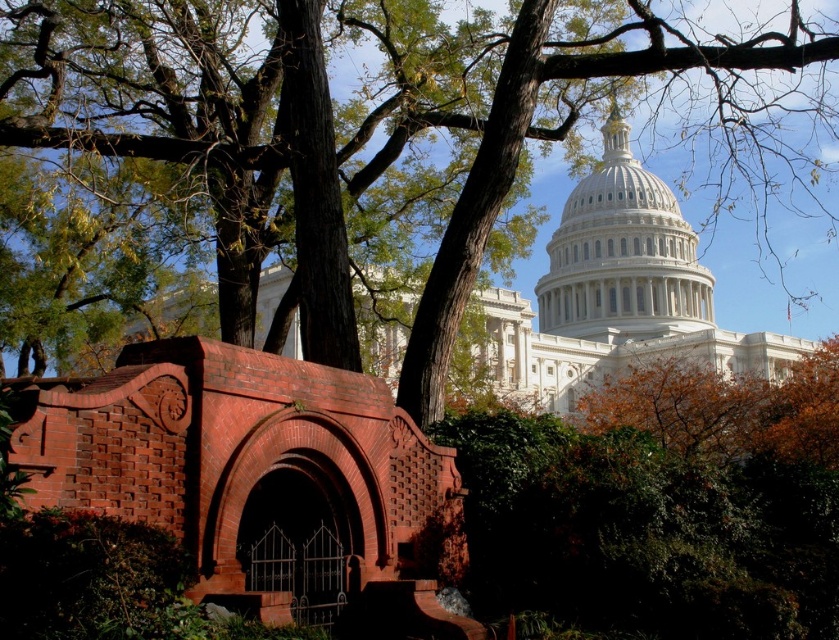
Question: Among these objects, which one is nearest to the camera?

Choices:
 (A) white marble dome at center
 (B) green leafy tree at upper center

Answer: (B)

Question: Is green leafy tree at upper center thinner than white marble dome at center?

Choices:
 (A) yes
 (B) no

Answer: (B)

Question: Which point is closer to the camera taking this photo?

Choices:
 (A) pyautogui.click(x=553, y=307)
 (B) pyautogui.click(x=94, y=196)

Answer: (B)

Question: Is green leafy tree at upper center above white marble dome at center?

Choices:
 (A) no
 (B) yes

Answer: (B)

Question: Which point is farther to the camera?

Choices:
 (A) green leafy tree at upper center
 (B) white marble dome at center

Answer: (B)

Question: Is green leafy tree at upper center smaller than white marble dome at center?

Choices:
 (A) no
 (B) yes

Answer: (A)